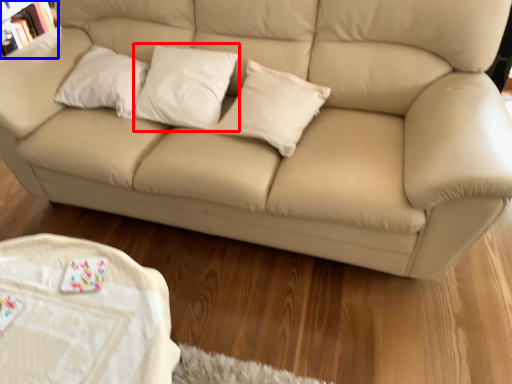
Question: Which point is further to the camera, pillow (highlighted by a red box) or bookcase (highlighted by a blue box)?

Choices:
 (A) pillow
 (B) bookcase

Answer: (B)